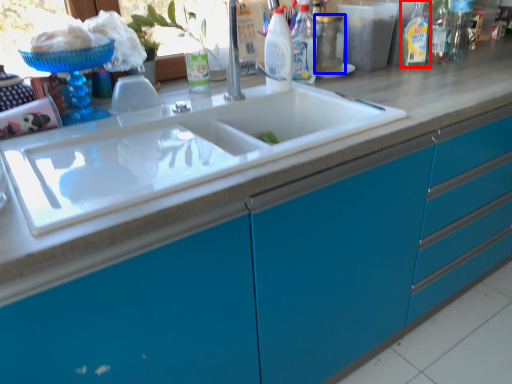
Question: Which object appears closest to the camera in this image, cleaning product (highlighted by a red box) or bottle (highlighted by a blue box)?

Choices:
 (A) cleaning product
 (B) bottle

Answer: (B)